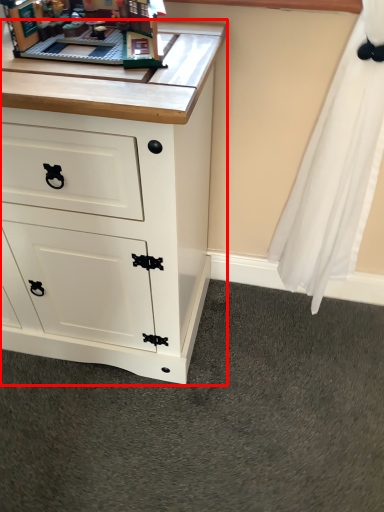
Question: From the image, what is the correct spatial relationship of chest of drawers (annotated by the red box) in relation to toy?

Choices:
 (A) right
 (B) left

Answer: (B)